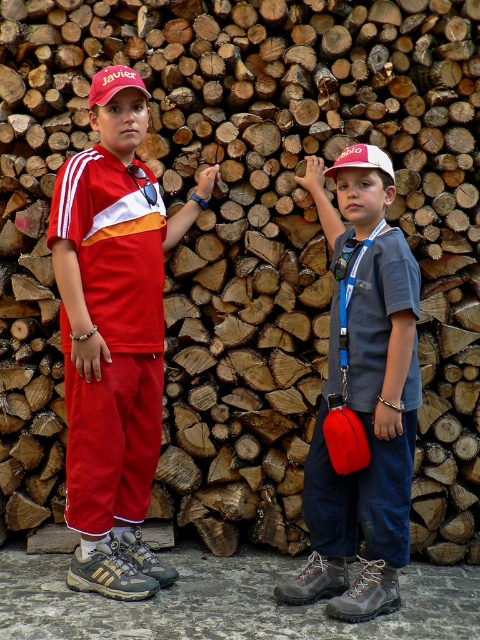
Question: Which of the following is the farthest from the observer?

Choices:
 (A) click(107, 83)
 (B) click(328, 176)
 (C) click(417, 401)
 (D) click(152, 310)

Answer: (B)

Question: Can you confirm if matte gray shirt at center is positioned to the right of white fabric baseball cap at upper center?

Choices:
 (A) yes
 (B) no

Answer: (B)

Question: Which of the following is the closest to the observer?

Choices:
 (A) (411, 433)
 (B) (130, 292)

Answer: (A)

Question: Which of these objects is positioned closest to the matte red baseball cap at upper left?

Choices:
 (A) matte red tracksuit at left
 (B) matte gray shirt at center

Answer: (A)

Question: Is matte red tracksuit at left thinner than matte gray shirt at center?

Choices:
 (A) no
 (B) yes

Answer: (A)

Question: Is matte red tracksuit at left smaller than matte gray shirt at center?

Choices:
 (A) yes
 (B) no

Answer: (B)